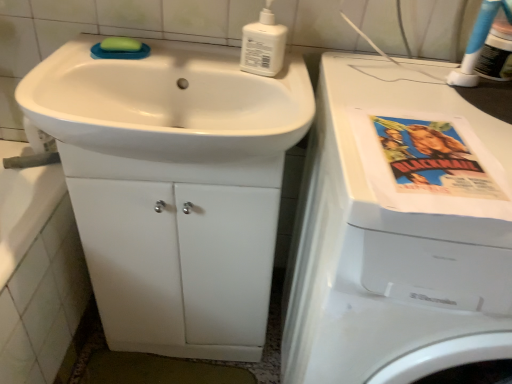
Question: From their relative heights in the image, would you say white glossy cabinet at center is taller or shorter than white plastic bottle at upper center?

Choices:
 (A) short
 (B) tall

Answer: (B)

Question: Is white glossy cabinet at center inside the boundaries of white plastic bottle at upper center, or outside?

Choices:
 (A) outside
 (B) inside

Answer: (A)

Question: Estimate the real-world distances between objects in this image. Which object is farther from the white plastic washing machine at right?

Choices:
 (A) white glossy cabinet at center
 (B) green matte soap at upper left
 (C) white plastic bottle at upper center
 (D) white glossy sink at center

Answer: (B)

Question: Estimate the real-world distances between objects in this image. Which object is closer to the white plastic bottle at upper center?

Choices:
 (A) white glossy cabinet at center
 (B) white plastic washing machine at right
 (C) green matte soap at upper left
 (D) white glossy sink at center

Answer: (D)